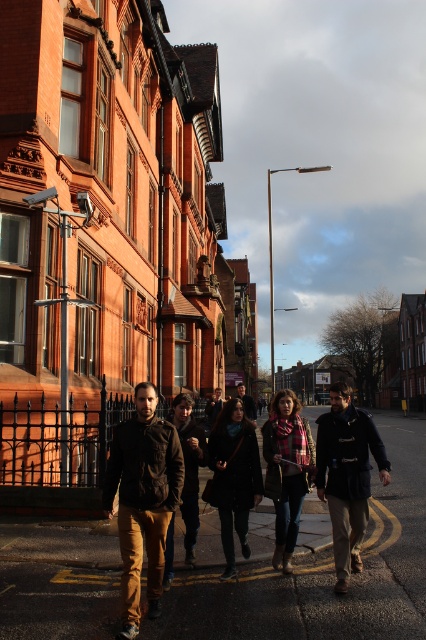
Question: Can you confirm if dark blue leather jacket at center is positioned below brown leather jacket at center?

Choices:
 (A) no
 (B) yes

Answer: (B)

Question: Is brown suede jacket at center wider than dark brown leather jacket at center?

Choices:
 (A) yes
 (B) no

Answer: (A)

Question: Which of the following is the closest to the observer?

Choices:
 (A) black wool coat at center
 (B) plaid wool scarf at center

Answer: (A)

Question: Estimate the real-world distances between objects in this image. Which object is farther from the dark blue leather jacket at center?

Choices:
 (A) brown leather jacket at center
 (B) brown suede jacket at center

Answer: (B)

Question: Which of the following is the closest to the observer?

Choices:
 (A) (163, 424)
 (B) (213, 396)
 (C) (184, 417)

Answer: (A)

Question: Does black wool coat at center have a greater width compared to plaid fabric scarf at center?

Choices:
 (A) yes
 (B) no

Answer: (B)